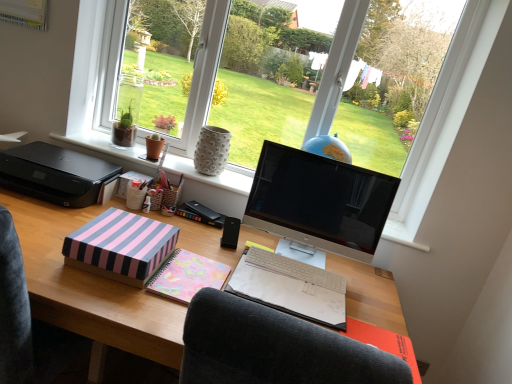
Locate an element on the screen. The width and height of the screenshot is (512, 384). free location to the left of white plastic keyboard at center is located at coordinates (227, 246).